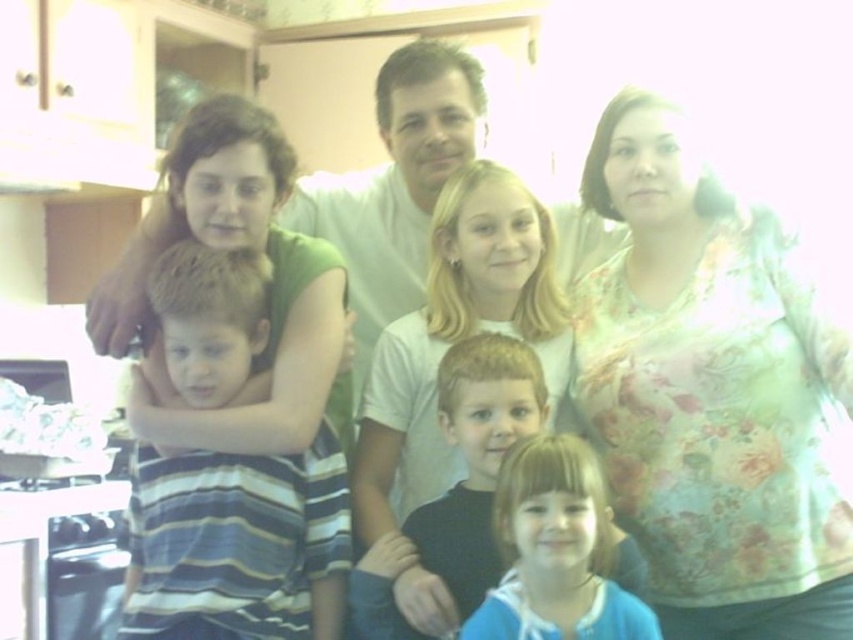
In the family photo taken in the kitchen, there is a person wearing a floral printed shirt at right. Where exactly is this shirt located in terms of coordinates?

The floral printed shirt at right is located at the 2D coordinates of point (711, 392).

You are standing in the kitchen and want to reach both the point at coordinates [694,262] and the point at coordinates [236,628]. Which point will you reach first as you move forward?

You will reach the point at coordinates [694,262] first because it is closer to you than the point at coordinates [236,628], which is further away.

In the family photo, there is a person wearing a floral printed shirt at right and another wearing a dark blue hoodie at center. Based on their positions, which clothing item is taller?

The floral printed shirt at right has a greater height compared to the dark blue hoodie at center.